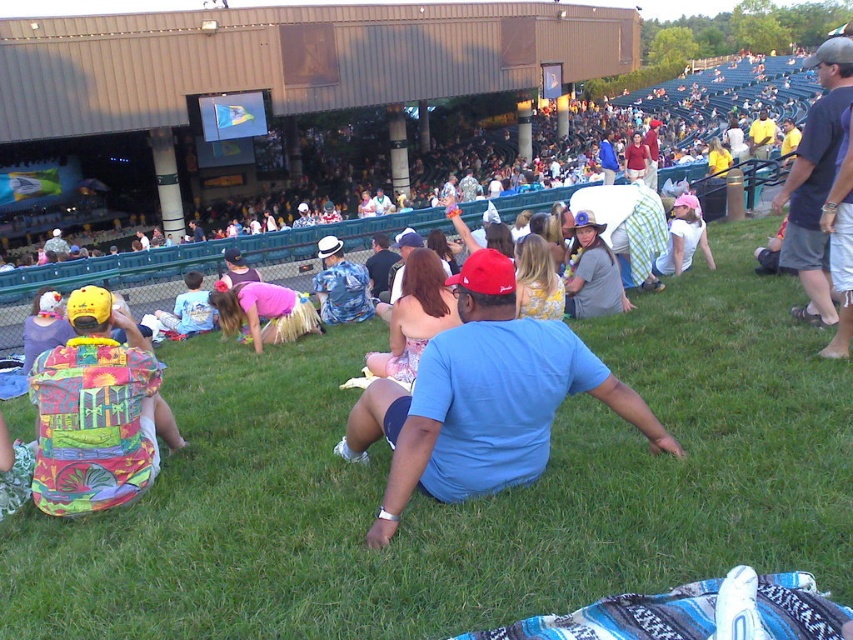
You are standing in the outdoor concert area and see the green grass at center and the matte gray shirt at center. From your perspective, which object is positioned to the left?

The green grass at center is to the left of the matte gray shirt at center, so the green grass at center is positioned to the left.